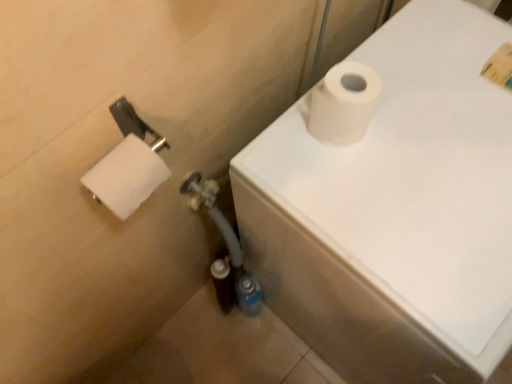
In order to face white matte toilet paper at left, arranged as the first toilet paper when viewed from the left, should I rotate leftwards or rightwards?

Rotate left and turn 15.415 degrees.

Describe the element at coordinates (344, 103) in the screenshot. I see `white matte toilet paper at upper right, acting as the first toilet paper starting from the right` at that location.

Where is `white matte toilet paper at upper right`? The height and width of the screenshot is (384, 512). white matte toilet paper at upper right is located at coordinates (394, 210).

This screenshot has height=384, width=512. Find the location of `white matte toilet paper at left, which is the 2th toilet paper from right to left`. white matte toilet paper at left, which is the 2th toilet paper from right to left is located at coordinates (128, 175).

Considering the positions of objects white matte toilet paper at left, arranged as the first toilet paper when viewed from the left, and white matte toilet paper at upper right in the image provided, who is more to the right, white matte toilet paper at left, arranged as the first toilet paper when viewed from the left, or white matte toilet paper at upper right?

Positioned to the right is white matte toilet paper at upper right.

Is white matte toilet paper at left, which is the 2th toilet paper from right to left, situated inside white matte toilet paper at upper right or outside?

The correct answer is: outside.

Is white matte toilet paper at left, which is the 2th toilet paper from right to left, looking in the opposite direction of white matte toilet paper at upper right?

No.

From the image's perspective, is white matte toilet paper at left, arranged as the first toilet paper when viewed from the left, positioned above or below white matte toilet paper at upper right?

white matte toilet paper at left, arranged as the first toilet paper when viewed from the left, is above white matte toilet paper at upper right.

Can you confirm if white matte toilet paper at upper right, acting as the first toilet paper starting from the right, is positioned to the right of white matte toilet paper at left, arranged as the first toilet paper when viewed from the left?

Yes, white matte toilet paper at upper right, acting as the first toilet paper starting from the right, is to the right of white matte toilet paper at left, arranged as the first toilet paper when viewed from the left.

Which point is more forward, (371, 111) or (117, 186)?

Point (117, 186)

Does white matte toilet paper at upper right, arranged as the 2th toilet paper when viewed from the left, have a larger size compared to white matte toilet paper at left, arranged as the first toilet paper when viewed from the left?

Yes, white matte toilet paper at upper right, arranged as the 2th toilet paper when viewed from the left, is bigger than white matte toilet paper at left, arranged as the first toilet paper when viewed from the left.

Could you tell me if white matte toilet paper at upper right, acting as the first toilet paper starting from the right, is facing white matte toilet paper at left, arranged as the first toilet paper when viewed from the left?

No, white matte toilet paper at upper right, acting as the first toilet paper starting from the right, is not aimed at white matte toilet paper at left, arranged as the first toilet paper when viewed from the left.

This screenshot has height=384, width=512. In the image, there is a white matte toilet paper at upper right, acting as the first toilet paper starting from the right. What are the coordinates of `bath below it (from the image's perspective)` in the screenshot? It's located at (394, 210).

Is white matte toilet paper at upper right, arranged as the 2th toilet paper when viewed from the left, completely or partially inside white matte toilet paper at upper right?

No, white matte toilet paper at upper right, arranged as the 2th toilet paper when viewed from the left, is not inside white matte toilet paper at upper right.

Considering the sizes of white matte toilet paper at upper right and white matte toilet paper at upper right, acting as the first toilet paper starting from the right, in the image, is white matte toilet paper at upper right wider or thinner than white matte toilet paper at upper right, acting as the first toilet paper starting from the right,?

Clearly, white matte toilet paper at upper right has more width compared to white matte toilet paper at upper right, acting as the first toilet paper starting from the right.

Which is further, (x=482, y=267) or (x=329, y=80)?

Point (x=329, y=80)

From a real-world perspective, between white matte toilet paper at upper right, arranged as the 2th toilet paper when viewed from the left, and white matte toilet paper at upper right, who is vertically higher?

white matte toilet paper at upper right, arranged as the 2th toilet paper when viewed from the left.

How different are the orientations of white matte toilet paper at upper right, acting as the first toilet paper starting from the right, and white matte toilet paper at upper right in degrees?

white matte toilet paper at upper right, acting as the first toilet paper starting from the right, and white matte toilet paper at upper right are facing 3.11 degrees away from each other.

How far apart are white matte toilet paper at upper right, acting as the first toilet paper starting from the right, and white matte toilet paper at upper right?

The distance of white matte toilet paper at upper right, acting as the first toilet paper starting from the right, from white matte toilet paper at upper right is 8.92 inches.

Is white matte toilet paper at upper right, arranged as the 2th toilet paper when viewed from the left, positioned in front of white matte toilet paper at upper right?

No, white matte toilet paper at upper right, arranged as the 2th toilet paper when viewed from the left, is behind white matte toilet paper at upper right.

Does white matte toilet paper at upper right have a lesser height compared to white matte toilet paper at left, which is the 2th toilet paper from right to left?

In fact, white matte toilet paper at upper right may be taller than white matte toilet paper at left, which is the 2th toilet paper from right to left.

From the image's perspective, between white matte toilet paper at upper right and white matte toilet paper at left, arranged as the first toilet paper when viewed from the left, which one is located above?

white matte toilet paper at left, arranged as the first toilet paper when viewed from the left.

Would you consider white matte toilet paper at upper right to be distant from white matte toilet paper at left, arranged as the first toilet paper when viewed from the left?

No.

Is the position of white matte toilet paper at left, arranged as the first toilet paper when viewed from the left, less distant than that of white matte toilet paper at upper right, acting as the first toilet paper starting from the right?

Yes, white matte toilet paper at left, arranged as the first toilet paper when viewed from the left, is closer to the viewer.

Is point (104, 175) closer to viewer compared to point (311, 134)?

Yes, point (104, 175) is closer to viewer.

Between white matte toilet paper at left, which is the 2th toilet paper from right to left, and white matte toilet paper at upper right, arranged as the 2th toilet paper when viewed from the left, which one has smaller size?

white matte toilet paper at left, which is the 2th toilet paper from right to left.

This screenshot has height=384, width=512. I want to click on toilet paper above the white matte toilet paper at left, which is the 2th toilet paper from right to left (from the image's perspective), so click(344, 103).

I want to click on bath to the right of white matte toilet paper at left, arranged as the first toilet paper when viewed from the left, so 394,210.

At what (x,y) coordinates should I click in order to perform the action: click on toilet paper that appears in front of the white matte toilet paper at upper right, arranged as the 2th toilet paper when viewed from the left. Please return your answer as a coordinate pair (x, y). The width and height of the screenshot is (512, 384). Looking at the image, I should click on (128, 175).

Consider the image. When comparing their distances from white matte toilet paper at upper right, does white matte toilet paper at left, which is the 2th toilet paper from right to left, or white matte toilet paper at upper right, acting as the first toilet paper starting from the right, seem further?

white matte toilet paper at left, which is the 2th toilet paper from right to left, is further to white matte toilet paper at upper right.

From the image, which object appears to be farther from white matte toilet paper at upper right, white matte toilet paper at upper right, acting as the first toilet paper starting from the right, or white matte toilet paper at left, arranged as the first toilet paper when viewed from the left?

Based on the image, white matte toilet paper at left, arranged as the first toilet paper when viewed from the left, appears to be further to white matte toilet paper at upper right.

From the image, which object appears to be farther from white matte toilet paper at left, which is the 2th toilet paper from right to left, white matte toilet paper at upper right or white matte toilet paper at upper right, arranged as the 2th toilet paper when viewed from the left?

white matte toilet paper at upper right.

Based on their spatial positions, is white matte toilet paper at upper right, arranged as the 2th toilet paper when viewed from the left, or white matte toilet paper at upper right further from white matte toilet paper at left, arranged as the first toilet paper when viewed from the left?

Based on the image, white matte toilet paper at upper right appears to be further to white matte toilet paper at left, arranged as the first toilet paper when viewed from the left.

Which object lies further to the anchor point white matte toilet paper at upper right, acting as the first toilet paper starting from the right, white matte toilet paper at upper right or white matte toilet paper at left, which is the 2th toilet paper from right to left?

white matte toilet paper at left, which is the 2th toilet paper from right to left, is further to white matte toilet paper at upper right, acting as the first toilet paper starting from the right.

Considering their positions, is white matte toilet paper at left, arranged as the first toilet paper when viewed from the left, positioned further to white matte toilet paper at upper right, arranged as the 2th toilet paper when viewed from the left, than white matte toilet paper at upper right?

white matte toilet paper at left, arranged as the first toilet paper when viewed from the left.

The height and width of the screenshot is (384, 512). In order to click on toilet paper between white matte toilet paper at left, which is the 2th toilet paper from right to left, and white matte toilet paper at upper right from left to right in this screenshot , I will do `click(344, 103)`.